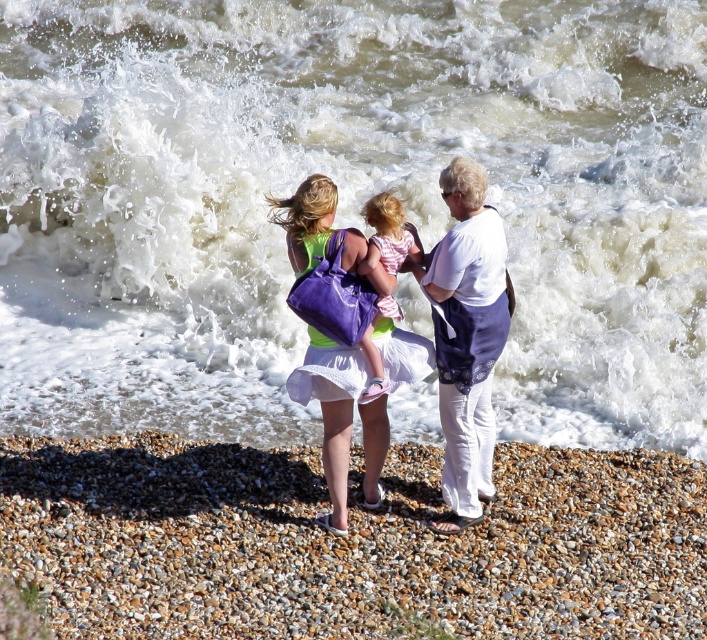
You are a photographer trying to capture the white frothy water at center and the matte purple bag at center in the same frame. Based on their sizes, which object will appear larger in the photo?

The white frothy water at center will appear larger in the photo because its width is larger than that of the matte purple bag at center.

You are a photographer at the beach and want to capture a photo of the two people wearing the white cotton shirt at center and the pink striped dress at center. Which clothing item will appear larger in the photo?

The white cotton shirt at center will appear larger in the photo because it is taller than the pink striped dress at center.